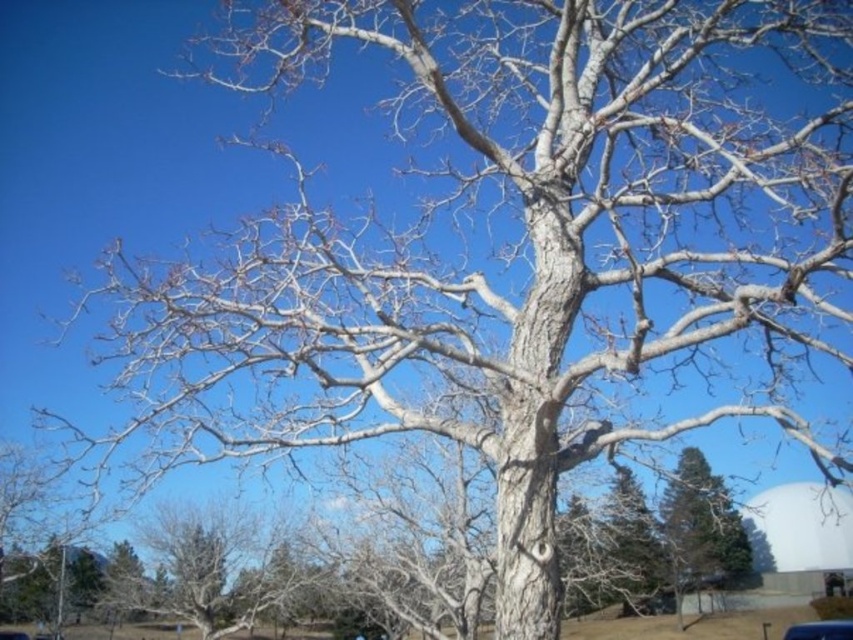
Question: Which of the following is the closest to the observer?

Choices:
 (A) (810, 628)
 (B) (724, 563)

Answer: (A)

Question: Considering the relative positions of smooth bark tree at lower right and metallic blue car at center in the image provided, where is smooth bark tree at lower right located with respect to metallic blue car at center?

Choices:
 (A) below
 (B) above

Answer: (A)

Question: Among these objects, which one is farthest from the camera?

Choices:
 (A) metallic blue car at center
 (B) smooth bark tree at lower right

Answer: (B)

Question: Where is smooth bark tree at lower right located in relation to metallic blue car at center in the image?

Choices:
 (A) below
 (B) above

Answer: (A)

Question: Considering the relative positions of smooth bark tree at lower right and metallic blue car at center in the image provided, where is smooth bark tree at lower right located with respect to metallic blue car at center?

Choices:
 (A) right
 (B) left

Answer: (A)